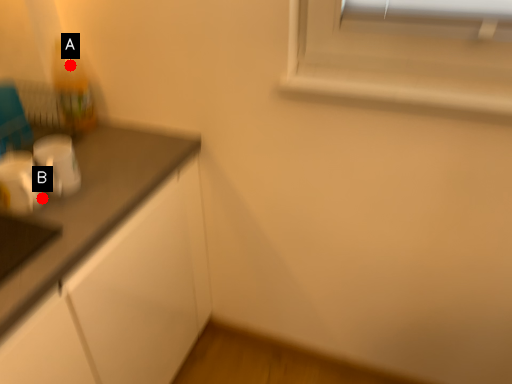
Question: Two points are circled on the image, labeled by A and B beside each circle. Which point appears farthest from the camera in this image?

Choices:
 (A) A is further
 (B) B is further

Answer: (A)